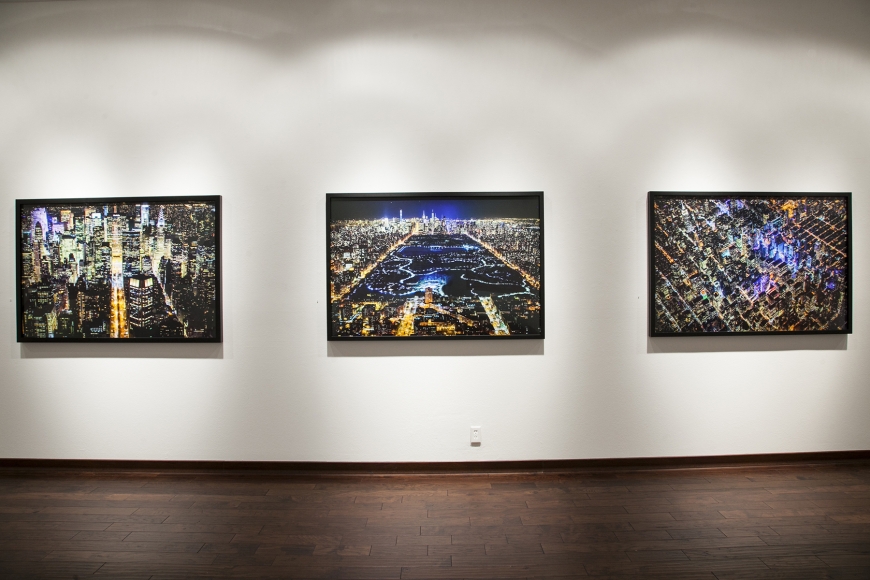
Locate an element on the screen. The image size is (870, 580). space below paintings is located at coordinates (102, 394), (430, 384), (792, 418).